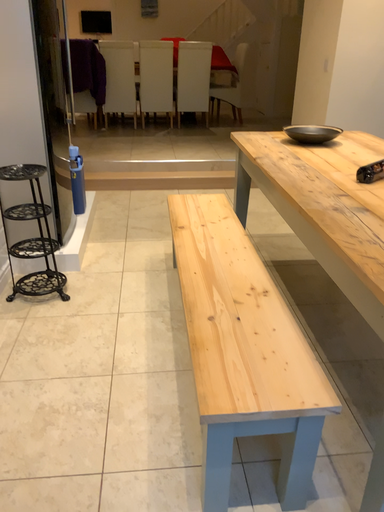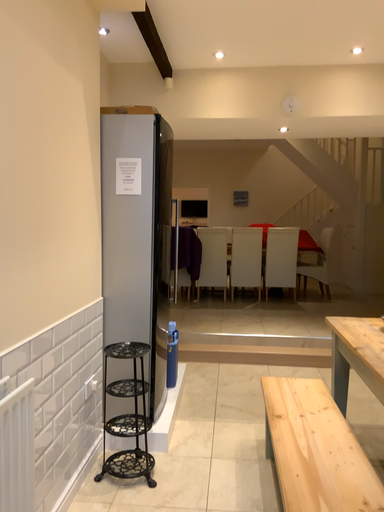
Question: How did the camera likely rotate when shooting the video?

Choices:
 (A) rotated downward
 (B) rotated upward

Answer: (B)